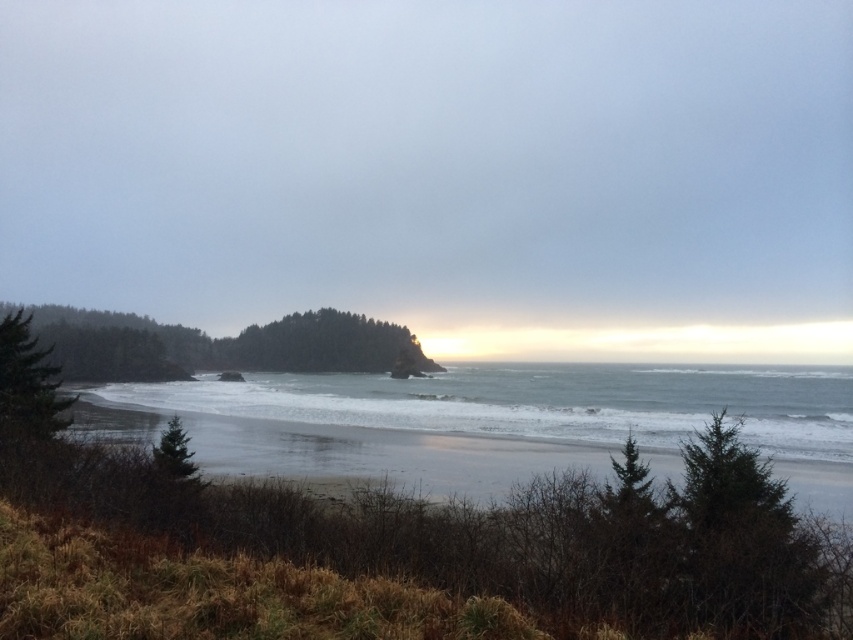
You are standing on the beach in the image and want to walk from the camera to the horizon. Which point, point (239, 397) or point (35, 317), would you reach first?

You would reach point (239, 397) first because it is closer to the camera than point (35, 317).

You are a hiker trying to navigate through the beach area. You need to pass between the green textured tree at lower right and the green matte tree at left. Can you fit through the space between them if your backpack is 1 meter wide?

The green textured tree at lower right is narrower than the green matte tree at left, but the exact width isn t specified. Without knowing the actual distance between them, it s impossible to determine if the 1 meter wide backpack can fit through.